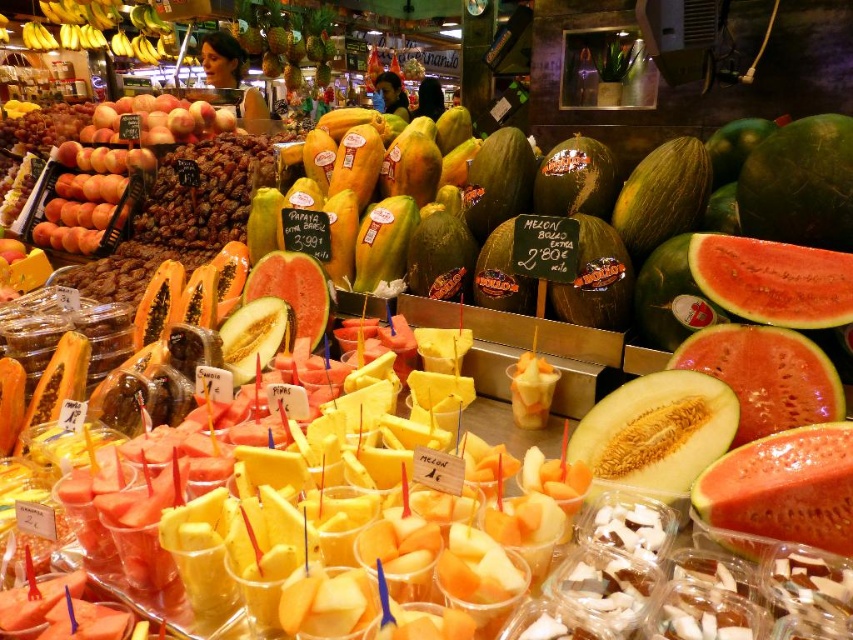
Can you confirm if matte orange peaches at center is positioned to the right of watermelon at center?

In fact, matte orange peaches at center is to the left of watermelon at center.

Between matte orange peaches at center and watermelon at center, which one has less height?

Standing shorter between the two is watermelon at center.

Is point (112, 161) closer to viewer compared to point (289, 291)?

No, (112, 161) is behind (289, 291).

Find the location of a particular element. matte orange peaches at center is located at coordinates (115, 173).

Does juicy red watermelon at center appear on the left side of ripe red watermelon at center?

Correct, you'll find juicy red watermelon at center to the left of ripe red watermelon at center.

Can you confirm if juicy red watermelon at center is taller than ripe red watermelon at center?

Correct, juicy red watermelon at center is much taller as ripe red watermelon at center.

Does point (793, 342) lie in front of point (787, 282)?

That is True.

The height and width of the screenshot is (640, 853). In order to click on juicy red watermelon at center in this screenshot , I will do `click(764, 376)`.

Between point (811, 433) and point (73, 237), which one is positioned in front?

Positioned in front is point (811, 433).

Does red textured watermelon at center right have a smaller size compared to matte orange peaches at center?

Yes, red textured watermelon at center right is smaller than matte orange peaches at center.

Identify the location of red textured watermelon at center right. (780, 492).